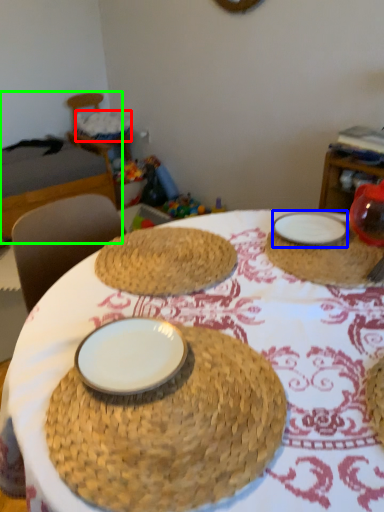
Question: Based on their relative distances, which object is farther from basket (highlighted by a red box)? Choose from plate (highlighted by a blue box) and bed (highlighted by a green box).

Choices:
 (A) plate
 (B) bed

Answer: (A)